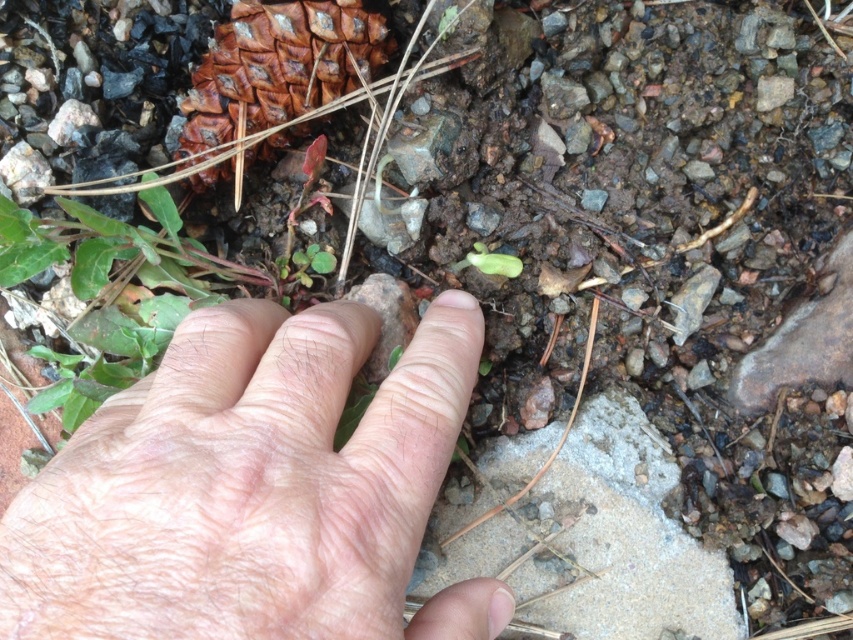
Measure the distance from pale skin at center to gray concrete stone at center.

pale skin at center is 19.97 centimeters from gray concrete stone at center.

Is pale skin at center to the right of gray concrete stone at center from the viewer's perspective?

In fact, pale skin at center is to the left of gray concrete stone at center.

This screenshot has height=640, width=853. In order to click on pale skin at center in this screenshot , I will do `click(253, 490)`.

What are the coordinates of `pale skin at center` in the screenshot? It's located at (253, 490).

Which is above, gray concrete stone at center or green matte seedling at center?

Positioned higher is green matte seedling at center.

Measure the distance between point [720,620] and camera.

The distance of point [720,620] from camera is 24.26 inches.

The width and height of the screenshot is (853, 640). I want to click on gray concrete stone at center, so click(602, 540).

Does pale skin at center appear under green matte seedling at center?

Yes, pale skin at center is below green matte seedling at center.

Is point (396, 380) behind point (480, 243)?

No.

The height and width of the screenshot is (640, 853). I want to click on pale skin at center, so click(253, 490).